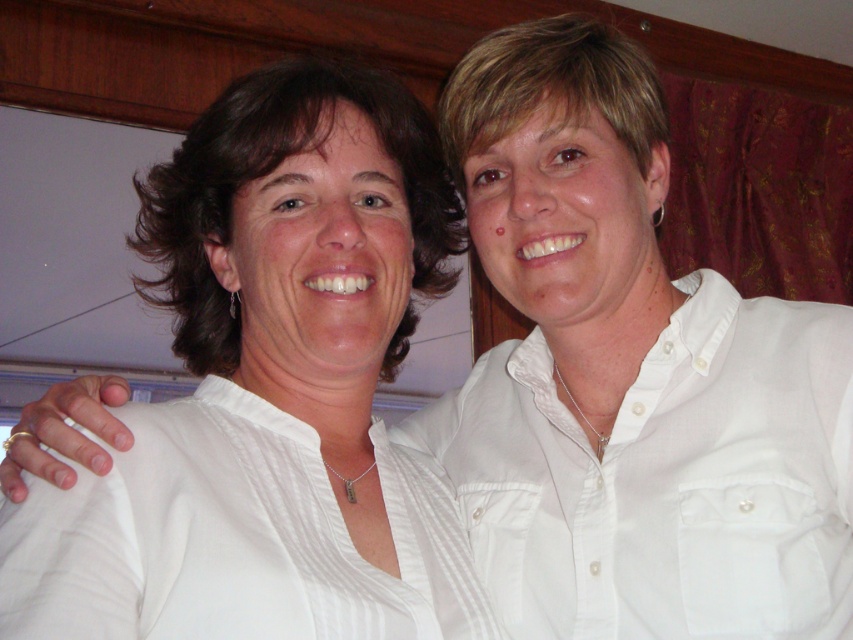
You are a tailor measuring shirts for alterations. You have a 30 cm long tailor board. The white cotton shirt at right and the white striped shirt at left need to be placed on the board. Which shirt should be placed first to ensure both fit on the board?

The white cotton shirt at right has a greater height compared to the white striped shirt at left. To ensure both fit on the 30 cm tailor board, place the taller white cotton shirt at right first, then the shorter white striped shirt at left.

Based on the scene description, where is the white cotton shirt at right located in the image?

The white cotton shirt at right is located at the 2D coordinates point (664, 477) in the image.

You are a photographer trying to capture a photo of the two people in the scene. You want to ensure that the white smooth shirt at center and the white cotton shirt at right are both visible in the frame. Based on their positions, which shirt should you focus on first to include both in the shot?

The white smooth shirt at center is to the left of the white cotton shirt at right, so focusing on the white cotton shirt at right first would allow you to frame both shirts since it is positioned further to the right, ensuring the left shirt remains within the shot as well.